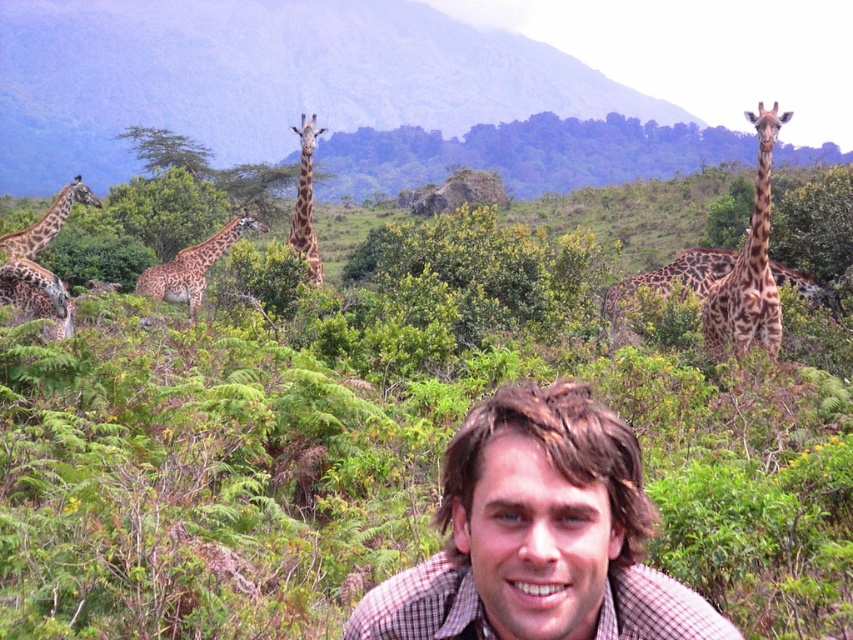
Question: Can you confirm if spotted fur giraffe at right is positioned above spotted fur giraffe at lower left?

Choices:
 (A) no
 (B) yes

Answer: (A)

Question: Does spotted fur giraffe at right appear over spotted fur giraffe at lower left?

Choices:
 (A) no
 (B) yes

Answer: (A)

Question: Which point appears closest to the camera in this image?

Choices:
 (A) (775, 332)
 (B) (305, 188)

Answer: (A)

Question: Which point is farther to the camera?

Choices:
 (A) green leafy bush at center
 (B) brown plaid shirt at center

Answer: (A)

Question: Among these points, which one is farthest from the camera?

Choices:
 (A) (9, 289)
 (B) (144, 68)
 (C) (247, 218)
 (D) (532, 467)

Answer: (B)

Question: Considering the relative positions of brown textured grassland at upper center and spotted fur giraffe at right in the image provided, where is brown textured grassland at upper center located with respect to spotted fur giraffe at right?

Choices:
 (A) below
 (B) above

Answer: (B)